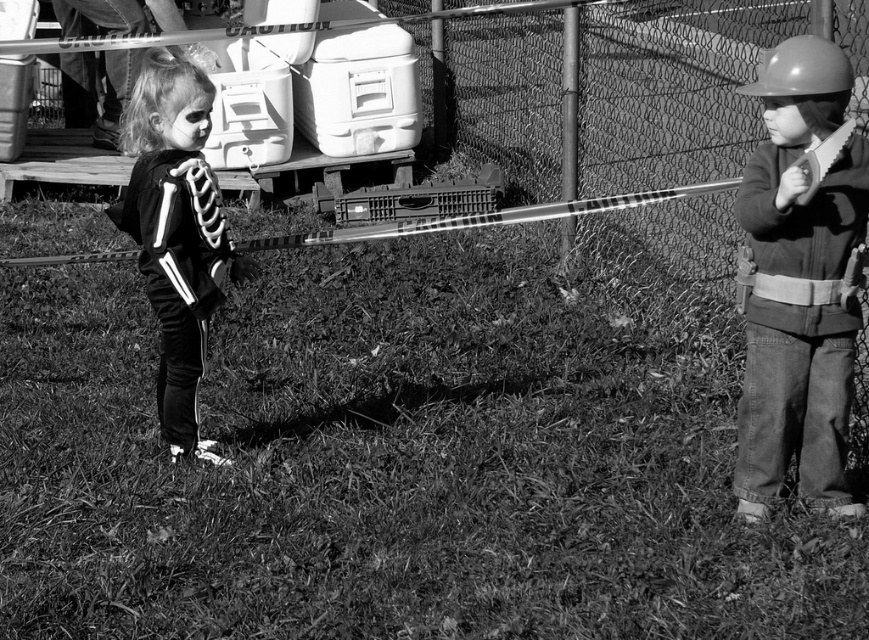
Is point (785, 74) positioned after point (103, 116)?

No, it is in front of (103, 116).

Describe the element at coordinates (799, 284) in the screenshot. This screenshot has height=640, width=869. I see `hard hat at right` at that location.

The width and height of the screenshot is (869, 640). I want to click on hard hat at right, so (x=799, y=284).

Is point (178, 310) positioned behind point (843, 92)?

Yes, point (178, 310) is behind point (843, 92).

Does black matte skeleton costume at left appear on the left side of matte gray helmet at right?

Indeed, black matte skeleton costume at left is positioned on the left side of matte gray helmet at right.

Does point (131, 108) come behind point (819, 99)?

That is True.

Identify the location of black matte skeleton costume at left. (176, 230).

Does hard hat at right have a lesser height compared to matte gray helmet at right?

Incorrect, hard hat at right's height does not fall short of matte gray helmet at right's.

Does hard hat at right have a greater width compared to matte gray helmet at right?

Indeed, hard hat at right has a greater width compared to matte gray helmet at right.

This screenshot has height=640, width=869. What are the coordinates of `hard hat at right` in the screenshot? It's located at (799, 284).

Where is `hard hat at right`? hard hat at right is located at coordinates (799, 284).